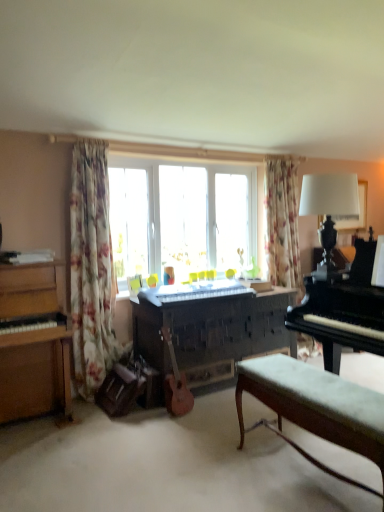
Question: Are white fabric lampshade at upper right and black polished piano at right, which is counted as the 1th piano, starting from the right, far apart?

Choices:
 (A) yes
 (B) no

Answer: (B)

Question: Does white fabric lampshade at upper right have a greater width compared to black polished piano at right, the 3th piano viewed from the left?

Choices:
 (A) yes
 (B) no

Answer: (B)

Question: Is white fabric lampshade at upper right facing away from black polished piano at right, the 3th piano viewed from the left?

Choices:
 (A) no
 (B) yes

Answer: (A)

Question: From the image's perspective, does white fabric lampshade at upper right appear lower than black polished piano at right, which is counted as the 1th piano, starting from the right?

Choices:
 (A) no
 (B) yes

Answer: (A)

Question: Considering the relative sizes of white fabric lampshade at upper right and black polished piano at right, which is counted as the 1th piano, starting from the right, in the image provided, is white fabric lampshade at upper right bigger than black polished piano at right, which is counted as the 1th piano, starting from the right,?

Choices:
 (A) yes
 (B) no

Answer: (B)

Question: In terms of width, does black polished piano at right, which is counted as the 1th piano, starting from the right, look wider or thinner when compared to white fabric lampshade at upper right?

Choices:
 (A) wide
 (B) thin

Answer: (A)

Question: Considering the positions of point (362, 263) and point (329, 248), is point (362, 263) closer or farther from the camera than point (329, 248)?

Choices:
 (A) closer
 (B) farther

Answer: (A)

Question: Relative to white fabric lampshade at upper right, is black polished piano at right, which is counted as the 1th piano, starting from the right, in front or behind?

Choices:
 (A) behind
 (B) front

Answer: (B)

Question: From the image's perspective, is black polished piano at right, the 3th piano viewed from the left, located above or below white fabric lampshade at upper right?

Choices:
 (A) below
 (B) above

Answer: (A)

Question: From a real-world perspective, relative to floral fabric curtain at upper right, the 1th curtain positioned from the back, is transparent glass window at center vertically above or below?

Choices:
 (A) below
 (B) above

Answer: (A)

Question: Is transparent glass window at center inside or outside of floral fabric curtain at upper right, marked as the 2th curtain in a left-to-right arrangement?

Choices:
 (A) outside
 (B) inside

Answer: (A)

Question: Based on their sizes in the image, would you say transparent glass window at center is bigger or smaller than floral fabric curtain at upper right, marked as the first curtain in a right-to-left arrangement?

Choices:
 (A) small
 (B) big

Answer: (B)

Question: Considering the positions of transparent glass window at center and floral fabric curtain at upper right, which is the 2th curtain in front-to-back order, in the image, is transparent glass window at center taller or shorter than floral fabric curtain at upper right, which is the 2th curtain in front-to-back order,?

Choices:
 (A) short
 (B) tall

Answer: (A)

Question: Is dark wood piano at center, marked as the second piano in a left-to-right arrangement, in front of or behind white fabric lampshade at upper right in the image?

Choices:
 (A) behind
 (B) front

Answer: (A)

Question: Is dark wood piano at center, marked as the second piano in a left-to-right arrangement, to the left or to the right of white fabric lampshade at upper right in the image?

Choices:
 (A) right
 (B) left

Answer: (B)